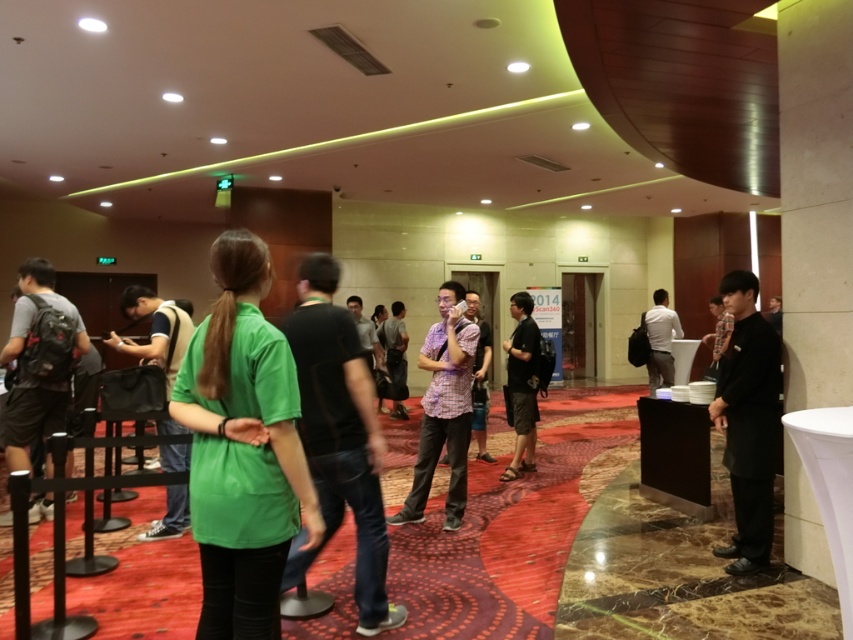
Looking at this image, you are organizing a photo shoot and need to arrange two shirts for a photoshoot setup. The plaid fabric shirt at center and the white matte shirt at center must be placed on a mannequin. Given their sizes, which shirt should be placed on the upper part of the mannequin to maintain balance?

The plaid fabric shirt at center has a smaller size compared to the white matte shirt at center. To maintain balance, the smaller plaid fabric shirt at center should be placed on the upper part of the mannequin, while the larger white matte shirt at center can be positioned lower to create a balanced arrangement.

You are organizing a photo shoot and need to place the black matte jacket at right and the white matte shirt at center in a way that maintains their size relationship. Which object should you place closer to the camera to achieve this?

To maintain the size relationship where the black matte jacket at right is smaller than the white matte shirt at center, you should place the black matte jacket at right further away from the camera and the white matte shirt at center closer to the camera. This way, the jacket appears smaller in the photo as it is farther back, matching their actual sizes in the scene.

You are organizing a backpack cleanup event and need to know which item takes up more space between the matte black backpack at left and the black matte shirt at center. Which one requires more storage space?

The matte black backpack at left is bigger than the black matte shirt at center, so it requires more storage space.